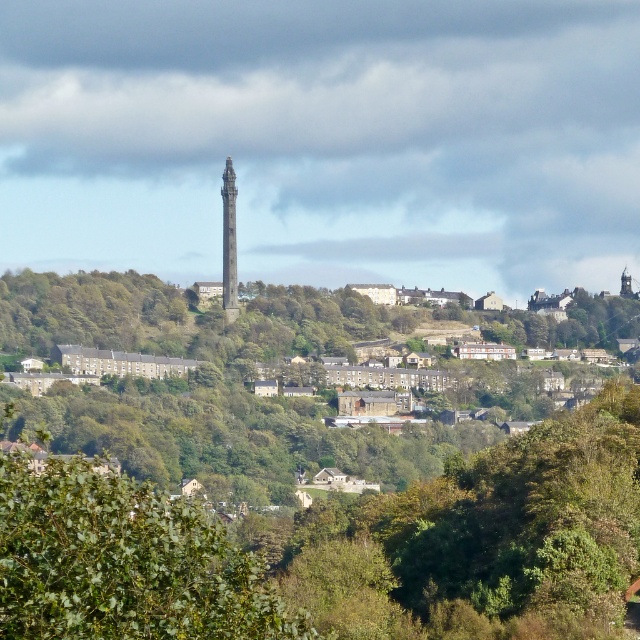
Is brown stone houses at center above smooth stone tower at center?

No, brown stone houses at center is not above smooth stone tower at center.

Can you confirm if brown stone houses at center is wider than smooth stone tower at center?

Yes, brown stone houses at center is wider than smooth stone tower at center.

The height and width of the screenshot is (640, 640). I want to click on brown stone houses at center, so click(x=236, y=385).